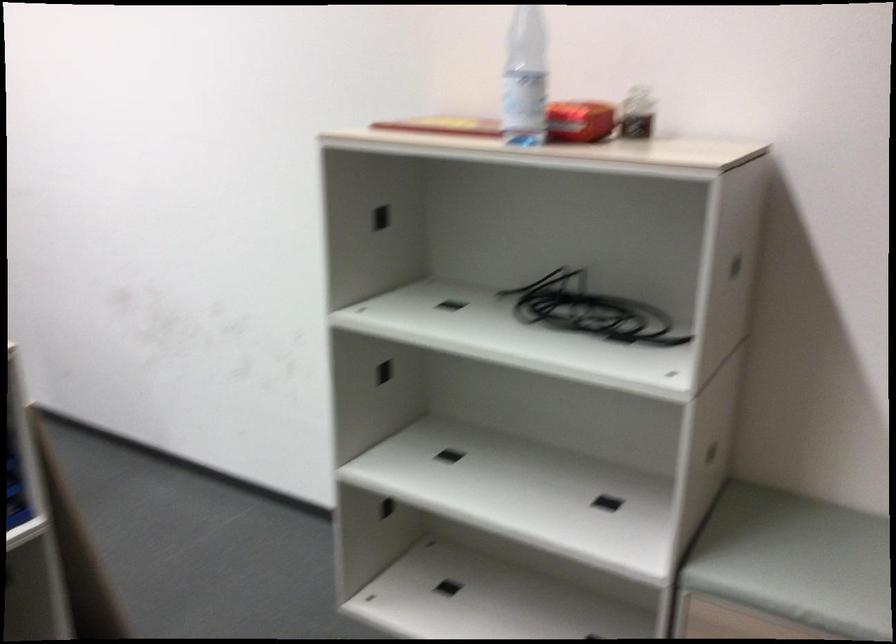
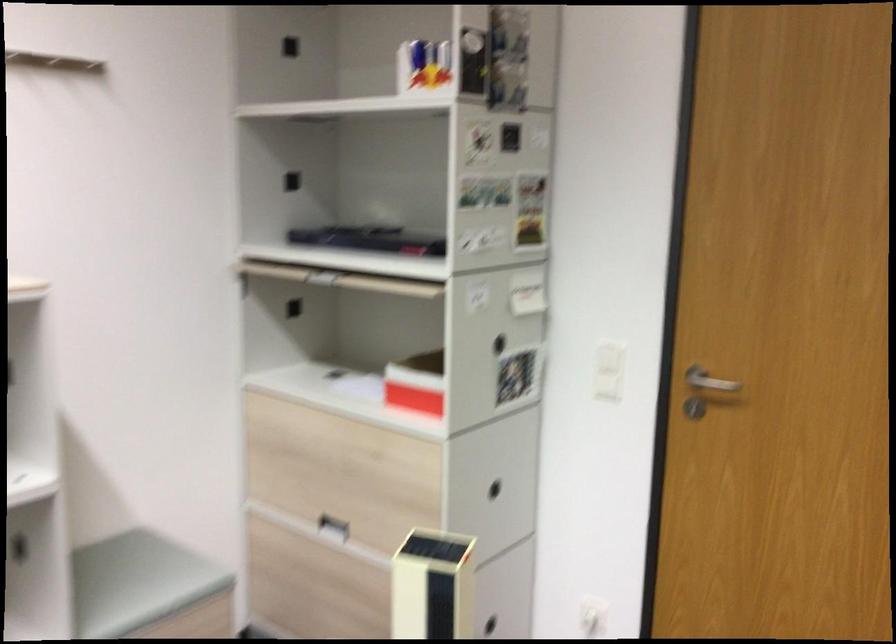
Question: The camera is either moving clockwise (left) or counter-clockwise (right) around the object. The first image is from the beginning of the video and the second image is from the end. Is the camera moving left or right when shooting the video?

Choices:
 (A) Left
 (B) Right

Answer: (A)